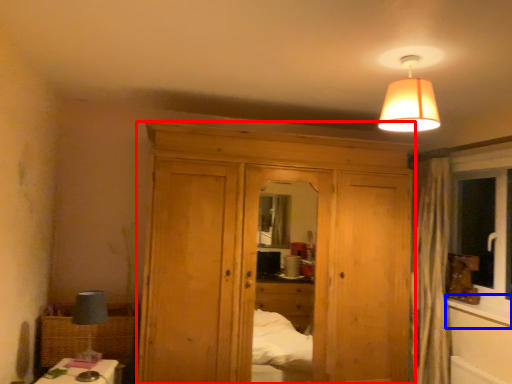
Question: Among these objects, which one is farthest to the camera, dresser (highlighted by a red box) or window sill (highlighted by a blue box)?

Choices:
 (A) dresser
 (B) window sill

Answer: (B)